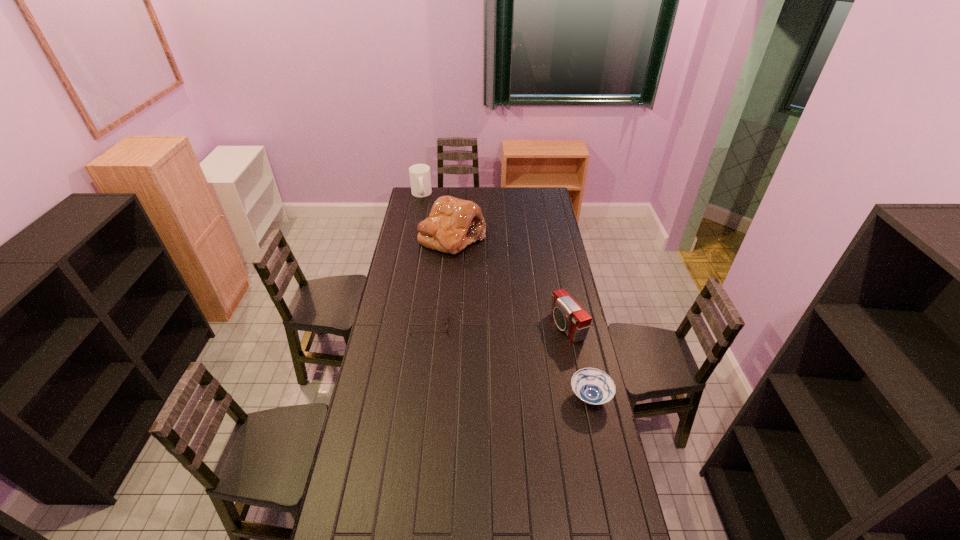
Locate an element on the screen. The height and width of the screenshot is (540, 960). bread located at the left edge is located at coordinates (453, 223).

Where is `mug at the left edge`? mug at the left edge is located at coordinates (420, 179).

The height and width of the screenshot is (540, 960). In order to click on soup bowl present at the right edge in this screenshot , I will do `click(593, 386)`.

Where is `camera that is at the right edge`? camera that is at the right edge is located at coordinates (570, 317).

The height and width of the screenshot is (540, 960). Identify the location of object at the far left corner. (420, 179).

This screenshot has width=960, height=540. Find the location of `free space at the far edge of the desktop`. free space at the far edge of the desktop is located at coordinates (520, 200).

In the image, there is a desktop. At what (x,y) coordinates should I click in order to perform the action: click on free region at the left edge. Please return your answer as a coordinate pair (x, y). Looking at the image, I should click on (412, 303).

I want to click on free space at the right edge of the desktop, so click(x=568, y=420).

Where is `vacant space that's between the bread and the shortest object`? vacant space that's between the bread and the shortest object is located at coordinates (442, 281).

This screenshot has width=960, height=540. In order to click on vacant region between the camera and the tallest object in this screenshot , I will do pos(510,282).